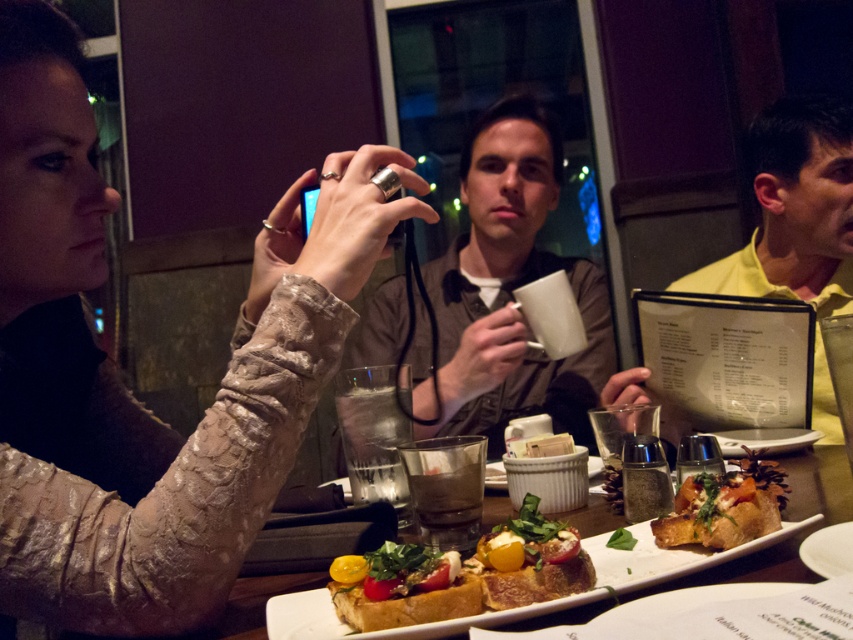
Is matte white mug at center bigger than yellow fabric shirt at right?

Yes, matte white mug at center is bigger than yellow fabric shirt at right.

Does matte white mug at center come in front of yellow fabric shirt at right?

Yes, matte white mug at center is closer to the viewer.

The width and height of the screenshot is (853, 640). I want to click on matte white mug at center, so click(x=494, y=296).

Can you confirm if white ceramic plate at center is positioned to the right of translucent glass at center?

Indeed, white ceramic plate at center is positioned on the right side of translucent glass at center.

Based on the photo, can you confirm if white ceramic plate at center is shorter than translucent glass at center?

In fact, white ceramic plate at center may be taller than translucent glass at center.

Between point (799, 502) and point (422, 529), which one is positioned behind?

Positioned behind is point (799, 502).

The width and height of the screenshot is (853, 640). Identify the location of white ceramic plate at center. (785, 518).

Locate an element on the screen. This screenshot has width=853, height=640. yellow fabric shirt at right is located at coordinates (793, 209).

Who is more distant from viewer, (787,140) or (699,522)?

Positioned behind is point (787,140).

The height and width of the screenshot is (640, 853). I want to click on yellow fabric shirt at right, so click(793, 209).